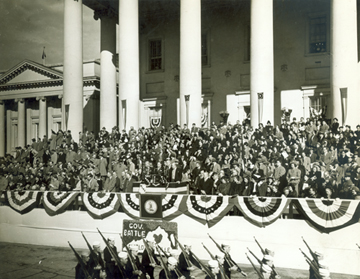
Image resolution: width=360 pixels, height=279 pixels. I want to click on windows, so click(152, 58), click(207, 50), click(247, 39), click(319, 48).